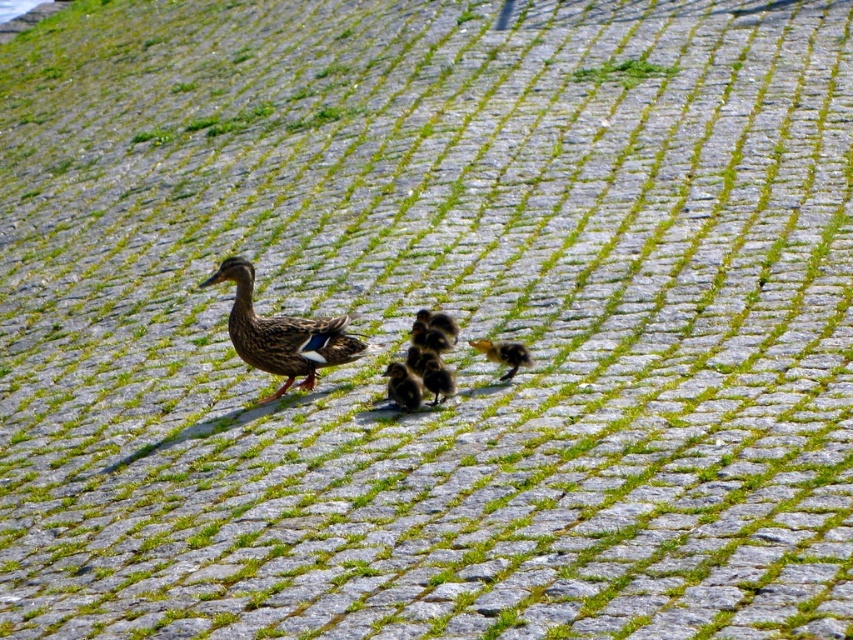
You are a child trying to count the ducklings in the image. You see a brown fluffy duckling at center and a brown fuzzy duckling at center. Are these two ducklings the same size?

The brown fluffy duckling at center is 11.63 inches away from brown fuzzy duckling at center, so they are likely different ducklings but their sizes cannot be determined based on distance alone.

You are a photographer trying to capture a photo of the brown fluffy duckling at center and the brown fuzzy duckling at center. Which duckling is positioned lower in the image?

The brown fluffy duckling at center is positioned lower than the brown fuzzy duckling at center.

You are a photographer trying to capture a photo of the brown feathered duckling at center and the soft yellow duckling at center. If your camera can focus on objects within a 20 inch range, will both ducklings be in focus at the same time?

The brown feathered duckling at center is 21.40 inches away from the soft yellow duckling at center. Since the distance between them exceeds the camera focus range of 20 inches, both ducklings cannot be in focus simultaneously.